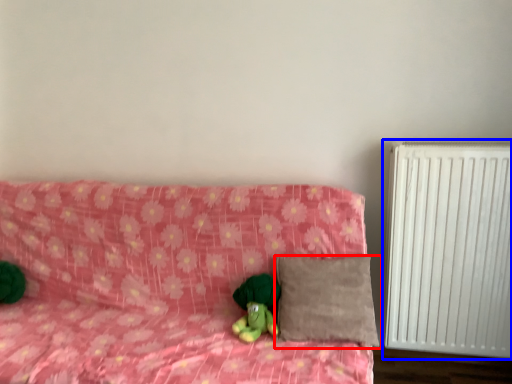
Question: Which object is closer to the camera taking this photo, pillow (highlighted by a red box) or radiator (highlighted by a blue box)?

Choices:
 (A) pillow
 (B) radiator

Answer: (A)